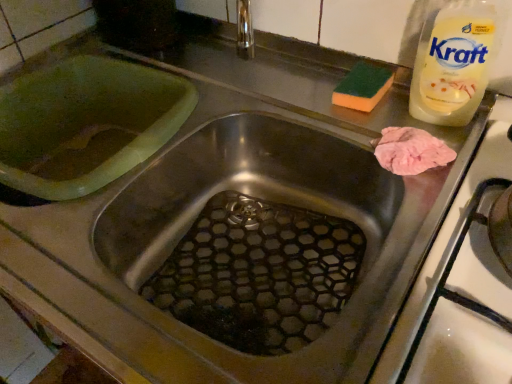
Describe the element at coordinates (453, 61) in the screenshot. The width and height of the screenshot is (512, 384). I see `white plastic bottle at upper right` at that location.

At what (x,y) coordinates should I click in order to perform the action: click on white plastic bottle at upper right. Please return your answer as a coordinate pair (x, y). Looking at the image, I should click on (453, 61).

Identify the location of white plastic bottle at upper right. The height and width of the screenshot is (384, 512). (453, 61).